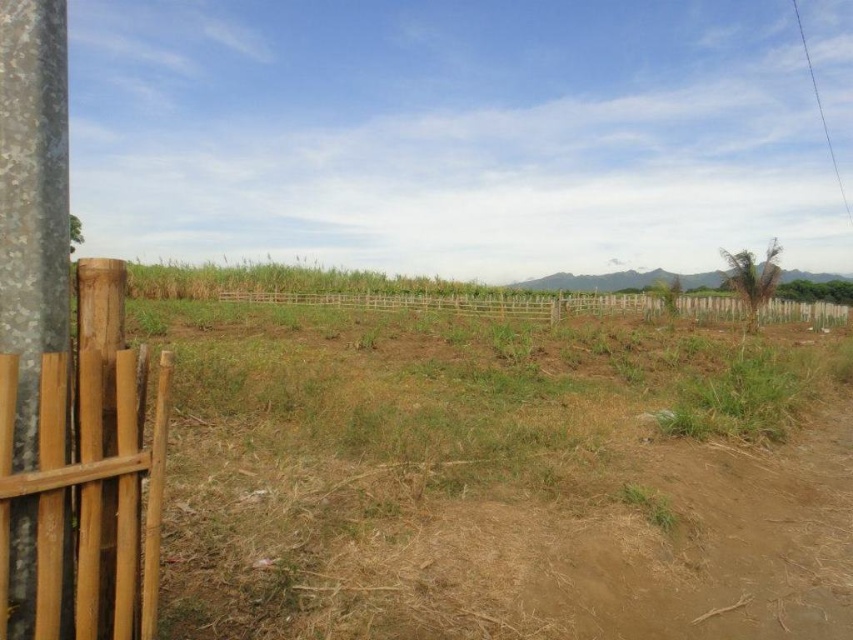
You are a farmer checking the field. You notice the brown dry soil at center and the brown wooden fence at left. Which one is wider in the image?

The brown dry soil at center is wider than the brown wooden fence at left according to the description.

You are a farmer checking the boundaries of your property. You notice a galvanized metal pole at left and a brown wooden fence at center. Which object appears smaller in the image?

The galvanized metal pole at left appears smaller than the brown wooden fence at center according to the description.